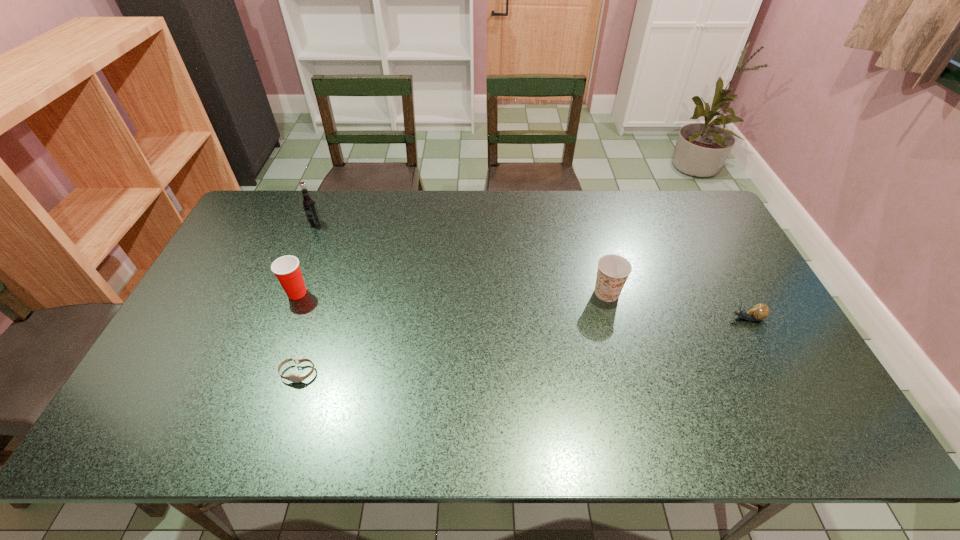
Locate an element on the screen. This screenshot has width=960, height=540. the farthest object is located at coordinates (308, 203).

At what (x,y) coordinates should I click in order to perform the action: click on root beer. Please return your answer as a coordinate pair (x, y). Looking at the image, I should click on (308, 203).

Where is `the left Dixie cup`? the left Dixie cup is located at coordinates (286, 268).

You are a GUI agent. You are given a task and a screenshot of the screen. Output one action in this format:
    pyautogui.click(x=<x>, y=<y>)
    Task: Click on the right Dixie cup
    The width and height of the screenshot is (960, 540).
    Given the screenshot: What is the action you would take?
    click(613, 270)

At what (x,y) coordinates should I click in order to perform the action: click on the rightmost object. Please return your answer as a coordinate pair (x, y). Looking at the image, I should click on (760, 311).

Find the location of `the second nearest object`. the second nearest object is located at coordinates tap(760, 311).

Find the location of a particular element. watch is located at coordinates (295, 378).

At what (x,y) coordinates should I click in order to perform the action: click on the shortest object. Please return your answer as a coordinate pair (x, y). Image resolution: width=960 pixels, height=540 pixels. Looking at the image, I should click on (295, 378).

Locate an element on the screen. The height and width of the screenshot is (540, 960). blank space located on the label of the tallest object is located at coordinates (276, 320).

The image size is (960, 540). What are the coordinates of `vacant space located 0.230m on the front of the left Dixie cup` in the screenshot? It's located at (266, 373).